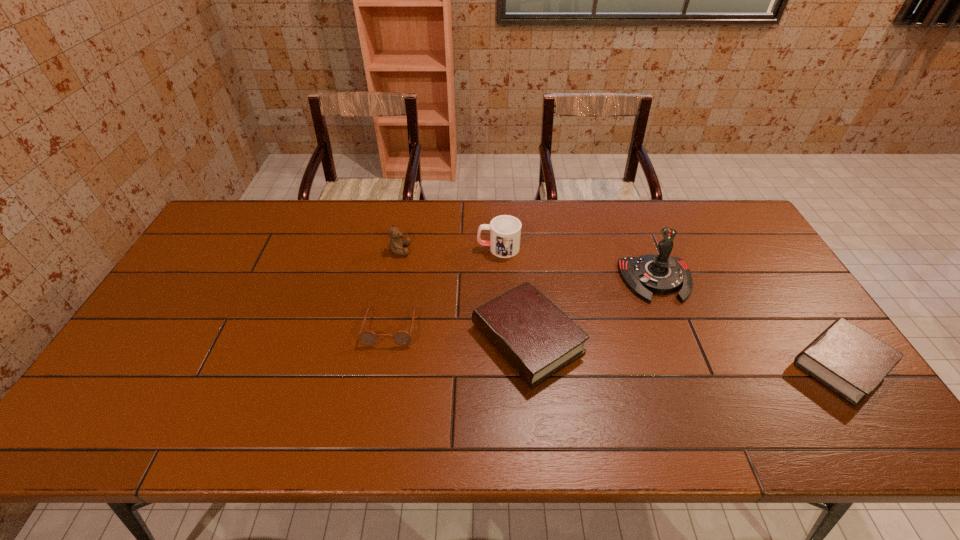
At what (x,y) coordinates should I click in order to perform the action: click on the left Bible. Please return your answer as a coordinate pair (x, y). Looking at the image, I should click on (535, 337).

Image resolution: width=960 pixels, height=540 pixels. I want to click on the taller Bible, so click(535, 337).

Locate an element on the screen. This screenshot has height=540, width=960. the right Bible is located at coordinates (851, 362).

The width and height of the screenshot is (960, 540). What are the coordinates of `the shorter Bible` in the screenshot? It's located at (851, 362).

Identify the location of the tallest object. (660, 274).

This screenshot has width=960, height=540. I want to click on joystick, so click(x=660, y=274).

The image size is (960, 540). Identify the location of teddy bear. (396, 245).

The width and height of the screenshot is (960, 540). I want to click on spectacles, so click(368, 338).

The width and height of the screenshot is (960, 540). Identify the location of mug. (505, 231).

Locate an element on the screen. vacant space located on the right of the third shortest object is located at coordinates (662, 339).